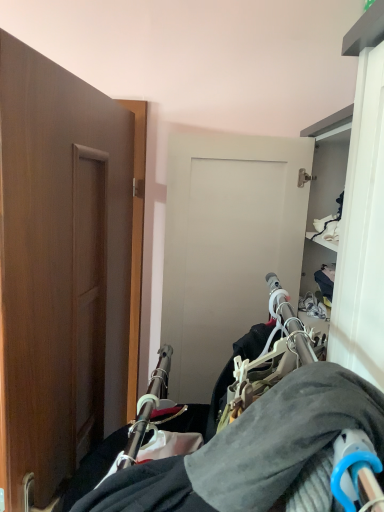
What do you see at coordinates (61, 266) in the screenshot? Image resolution: width=384 pixels, height=512 pixels. I see `wooden door at left` at bounding box center [61, 266].

This screenshot has height=512, width=384. I want to click on wooden door at left, so click(x=61, y=266).

This screenshot has width=384, height=512. I want to click on wooden door at left, so click(61, 266).